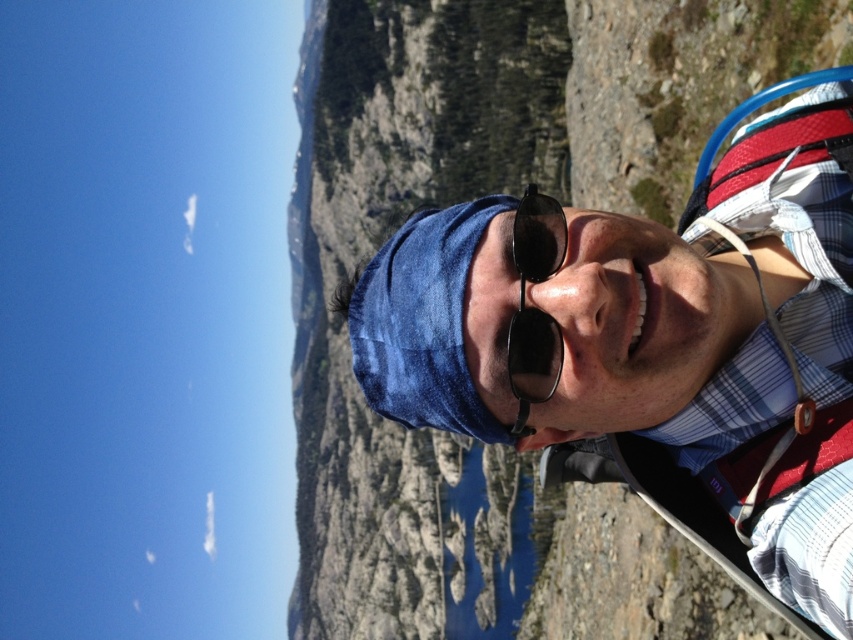
Question: Does blue denim bandana at center have a lesser width compared to white fabric strap at right?

Choices:
 (A) no
 (B) yes

Answer: (A)

Question: Which of these objects is positioned closest to the black reflective sunglasses at center?

Choices:
 (A) blue denim bandana at center
 (B) white fabric strap at right

Answer: (B)

Question: Which of these objects is positioned farthest from the black reflective sunglasses at center?

Choices:
 (A) white fabric strap at right
 (B) blue denim bandana at center

Answer: (B)

Question: Is blue denim bandana at center positioned in front of black reflective sunglasses at center?

Choices:
 (A) no
 (B) yes

Answer: (A)

Question: Is blue denim bandana at center behind black reflective sunglasses at center?

Choices:
 (A) yes
 (B) no

Answer: (A)

Question: Which object is closer to the camera taking this photo?

Choices:
 (A) black reflective sunglasses at center
 (B) blue denim bandana at center
 (C) white fabric strap at right

Answer: (A)